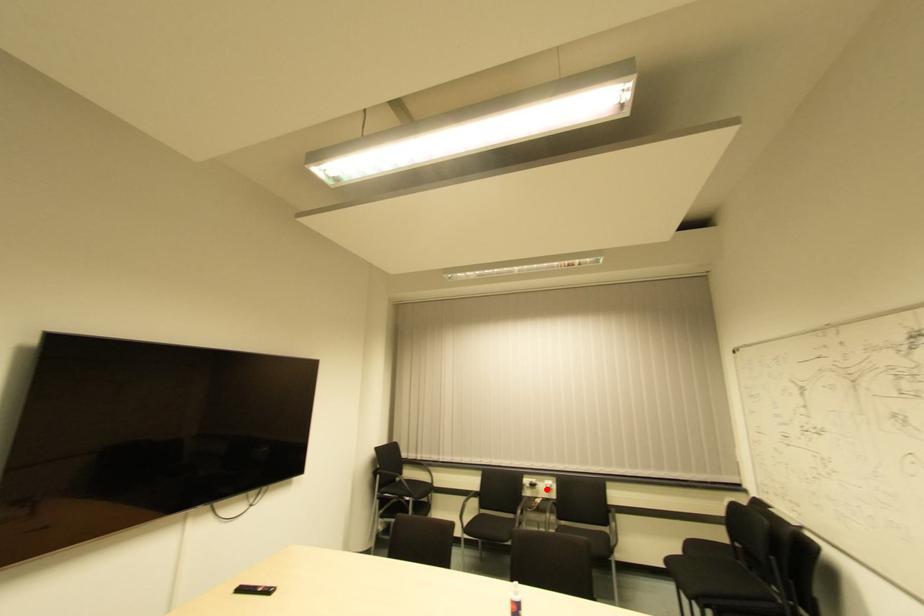
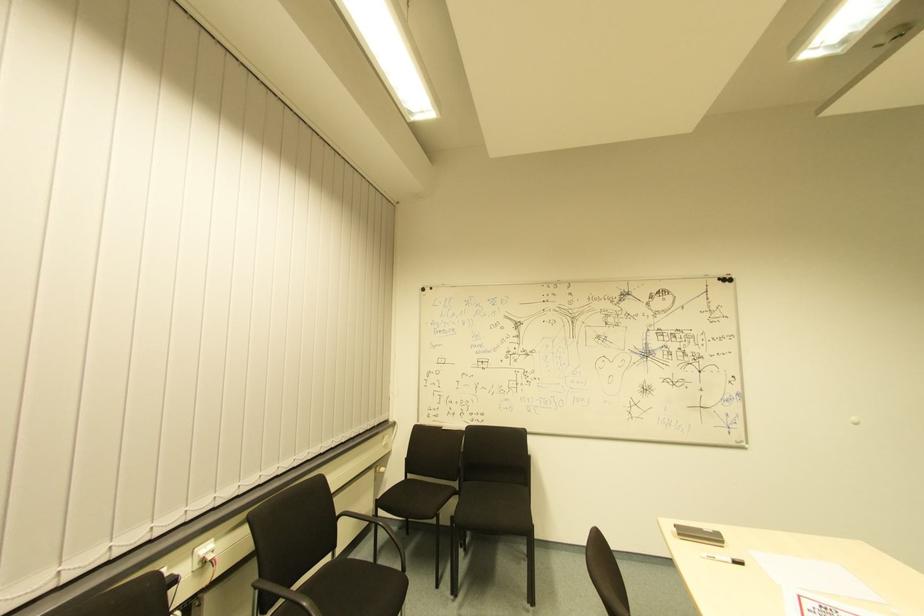
Question: I am providing you with two images of the same scene from different viewpoints. Image1 has a red point marked. In image2, the corresponding 3D location appears at what relative position? Reply with the corresponding letter.

Choices:
 (A) Closer
 (B) Farther

Answer: (A)